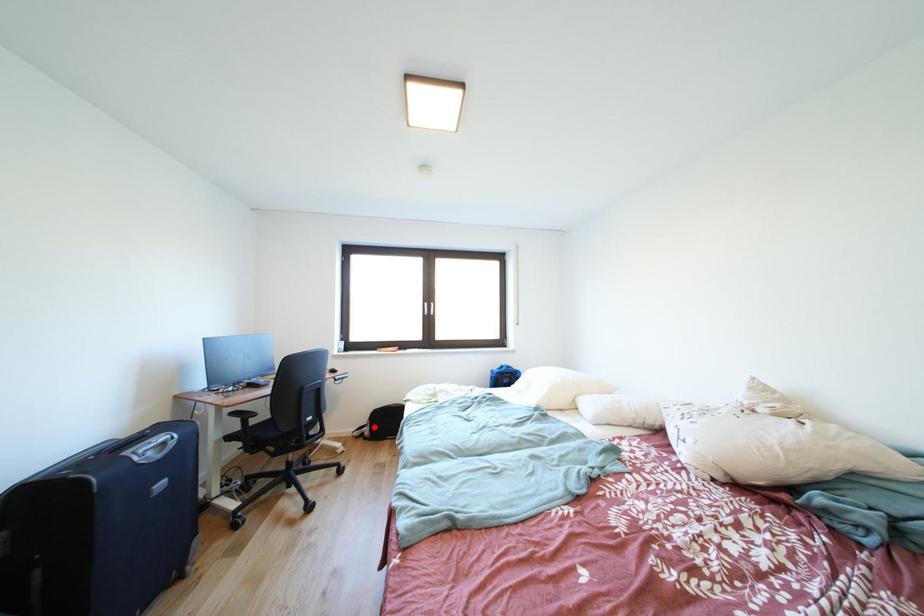
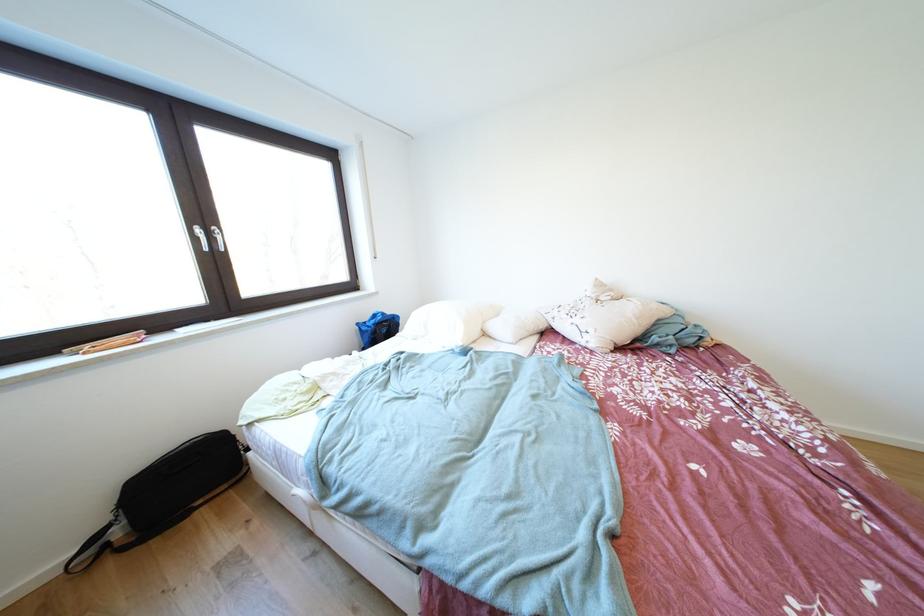
Question: I am providing you with two images of the same scene from different viewpoints. A red point is shown in image1. For the corresponding object point in image2, is it positioned nearer or farther from the camera?

Choices:
 (A) Nearer
 (B) Farther

Answer: (B)